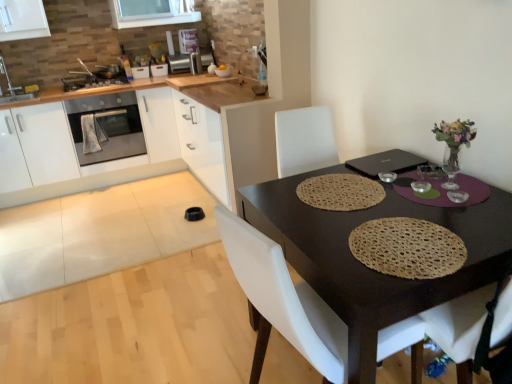
Question: Is white glossy sink at upper left to the right of wooden countertop at upper center from the viewer's perspective?

Choices:
 (A) no
 (B) yes

Answer: (A)

Question: Considering the relative sizes of white glossy sink at upper left and wooden countertop at upper center in the image provided, is white glossy sink at upper left bigger than wooden countertop at upper center?

Choices:
 (A) yes
 (B) no

Answer: (B)

Question: Could you tell me if white glossy sink at upper left is turned towards wooden countertop at upper center?

Choices:
 (A) no
 (B) yes

Answer: (A)

Question: Would you say white glossy sink at upper left contains wooden countertop at upper center?

Choices:
 (A) no
 (B) yes

Answer: (A)

Question: Is the position of white glossy sink at upper left less distant than that of wooden countertop at upper center?

Choices:
 (A) yes
 (B) no

Answer: (B)

Question: From a real-world perspective, is white glossy sink at upper left located higher than wooden countertop at upper center?

Choices:
 (A) no
 (B) yes

Answer: (B)

Question: From the image's perspective, does white glossy sink at upper left appear higher than satin silver toaster at upper center, the fourth appliance positioned from the left?

Choices:
 (A) yes
 (B) no

Answer: (B)

Question: Is white glossy sink at upper left facing towards satin silver toaster at upper center, marked as the first appliance in a right-to-left arrangement?

Choices:
 (A) no
 (B) yes

Answer: (A)

Question: Does white glossy sink at upper left have a lesser width compared to satin silver toaster at upper center, the fourth appliance positioned from the left?

Choices:
 (A) yes
 (B) no

Answer: (B)

Question: Is white glossy sink at upper left taller than satin silver toaster at upper center, marked as the first appliance in a right-to-left arrangement?

Choices:
 (A) yes
 (B) no

Answer: (A)

Question: Is white glossy sink at upper left bigger than satin silver toaster at upper center, the fourth appliance positioned from the left?

Choices:
 (A) yes
 (B) no

Answer: (A)

Question: Can you confirm if white glossy sink at upper left is positioned to the left of satin silver toaster at upper center, marked as the first appliance in a right-to-left arrangement?

Choices:
 (A) no
 (B) yes

Answer: (B)

Question: Can you confirm if metallic silver stove at upper left, the 4th appliance from the right, is thinner than woven beige placemat at table center?

Choices:
 (A) no
 (B) yes

Answer: (A)